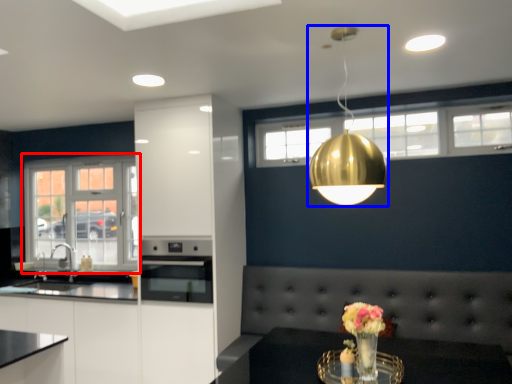
Question: Among these objects, which one is nearest to the camera, window (highlighted by a red box) or lamp (highlighted by a blue box)?

Choices:
 (A) window
 (B) lamp

Answer: (B)